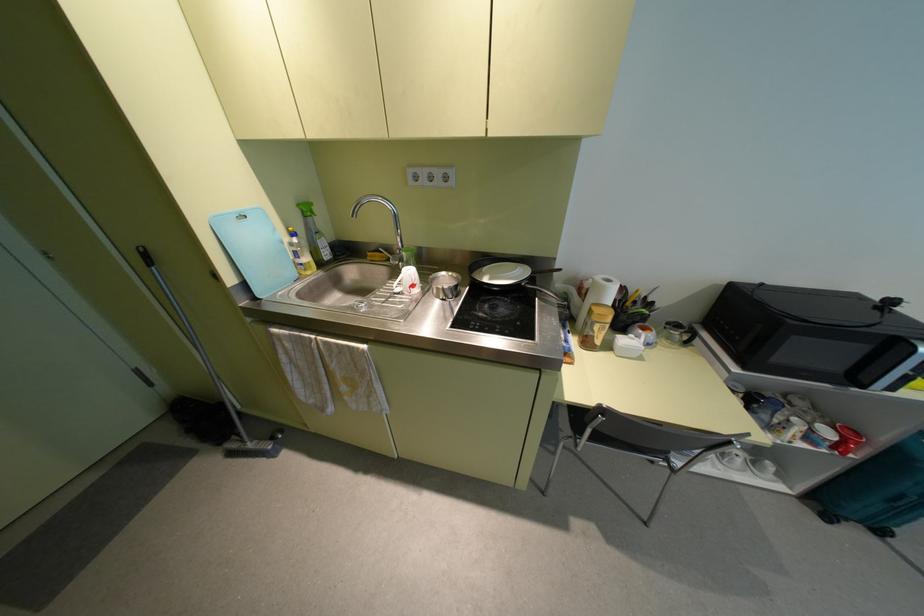
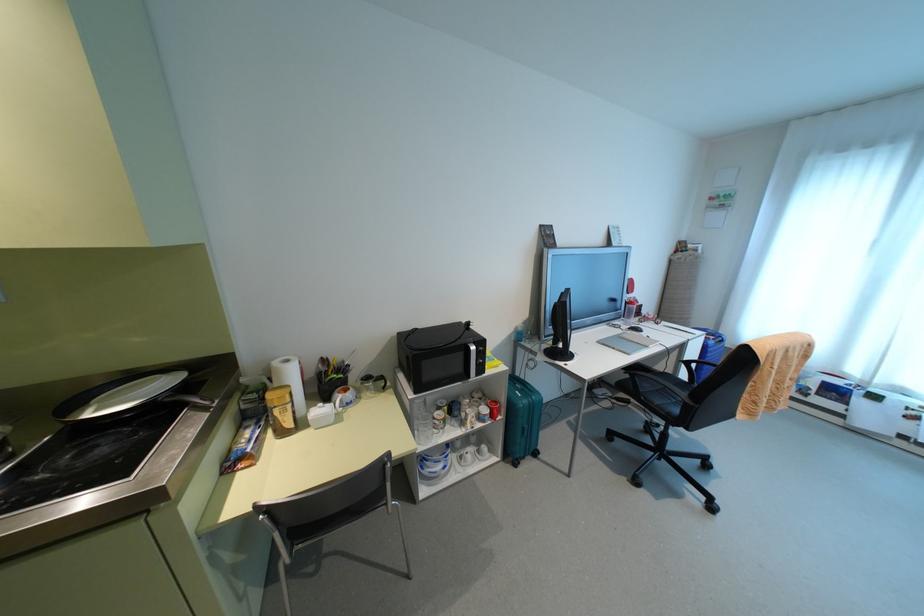
Find the pixel in the second image that matches [857,434] in the first image.

(495, 402)